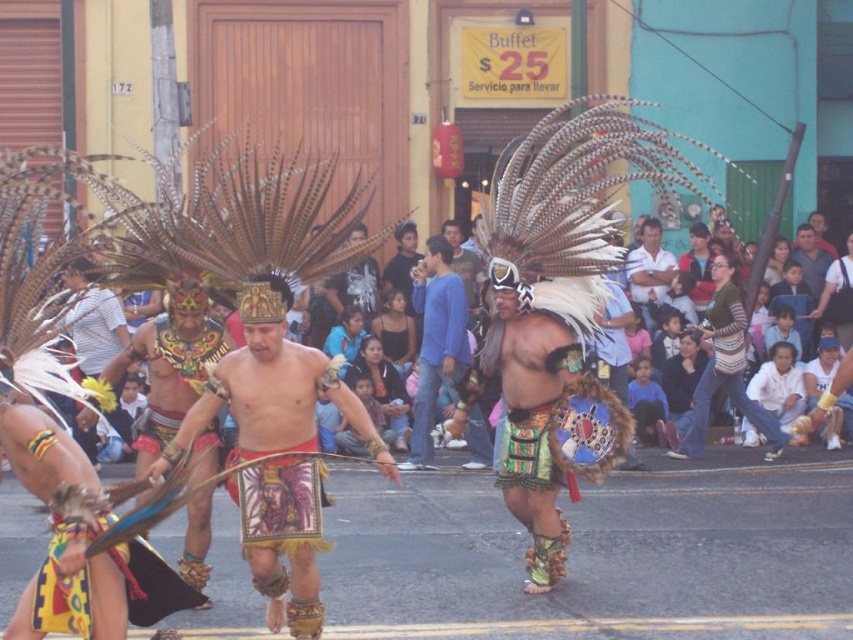
Question: Estimate the real-world distances between objects in this image. Which object is farther from the matte black shirt at center?

Choices:
 (A) matte leather shield at center
 (B) shiny gold headdress at center
 (C) matte gold headdress at center

Answer: (A)

Question: Among these points, which one is nearest to the camera?

Choices:
 (A) (270, 481)
 (B) (418, 465)

Answer: (A)

Question: Does matte brown leather jacket at center appear over dark blue shirt at center?

Choices:
 (A) yes
 (B) no

Answer: (B)

Question: Which object is farther from the camera taking this photo?

Choices:
 (A) matte leather shield at center
 (B) blue cotton shirt at center
 (C) white shirt at center

Answer: (C)

Question: Can you confirm if matte leather shield at center is wider than dark blue shirt at center?

Choices:
 (A) yes
 (B) no

Answer: (A)

Question: Where is matte gold headdress at center located in relation to matte brown leather jacket at center in the image?

Choices:
 (A) right
 (B) left

Answer: (B)